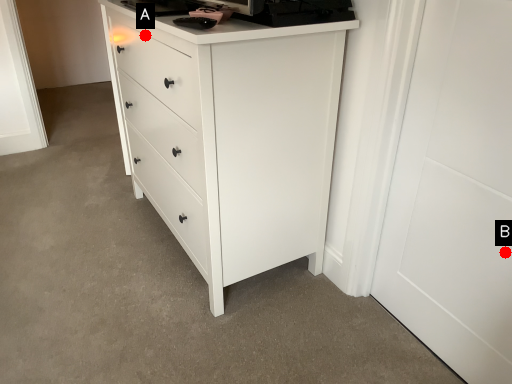
Question: Two points are circled on the image, labeled by A and B beside each circle. Which point is closer to the camera?

Choices:
 (A) A is closer
 (B) B is closer

Answer: (B)